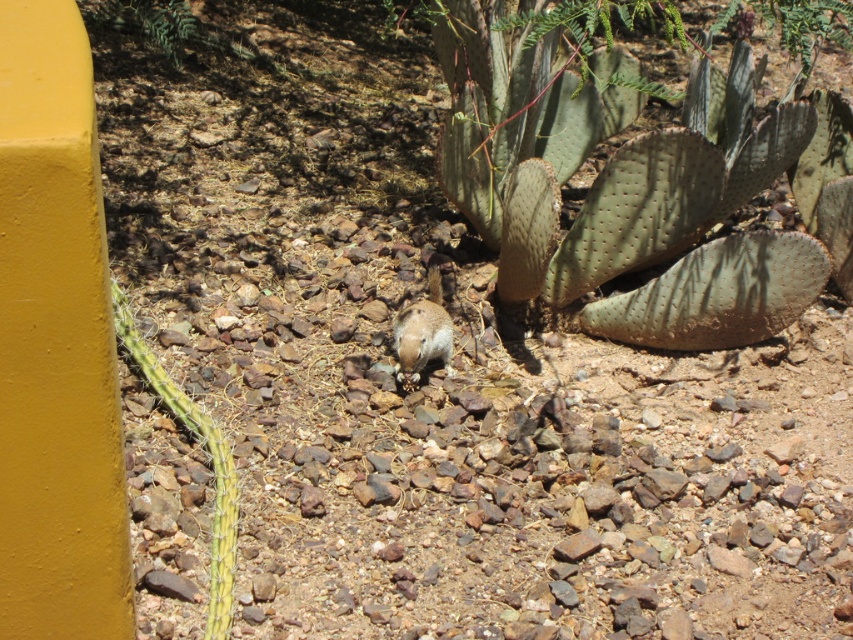
Identify the location of green spiny cactus at center. (636, 186).

Is green spiny cactus at center taller than brown furry squirrel at center?

Yes, green spiny cactus at center is taller than brown furry squirrel at center.

Does point (480, 8) lie behind point (395, 314)?

No, (480, 8) is in front of (395, 314).

This screenshot has height=640, width=853. Find the location of `green spiny cactus at center`. green spiny cactus at center is located at coordinates coord(636,186).

Between green spiny cactus at center and green spiny cactus at lower left, which one appears on the right side from the viewer's perspective?

A: green spiny cactus at center is more to the right.

Which is more to the left, green spiny cactus at center or green spiny cactus at lower left?

green spiny cactus at lower left is more to the left.

This screenshot has width=853, height=640. I want to click on green spiny cactus at center, so click(x=636, y=186).

At what (x,y) coordinates should I click in order to perform the action: click on green spiny cactus at center. Please return your answer as a coordinate pair (x, y). This screenshot has width=853, height=640. Looking at the image, I should click on (636, 186).

Can you confirm if green spiny cactus at lower left is positioned to the left of brown furry squirrel at center?

Yes, green spiny cactus at lower left is to the left of brown furry squirrel at center.

Is green spiny cactus at lower left positioned before brown furry squirrel at center?

That is True.

Which is in front, point (200, 424) or point (393, 340)?

Positioned in front is point (200, 424).

The width and height of the screenshot is (853, 640). Identify the location of green spiny cactus at lower left. (202, 451).